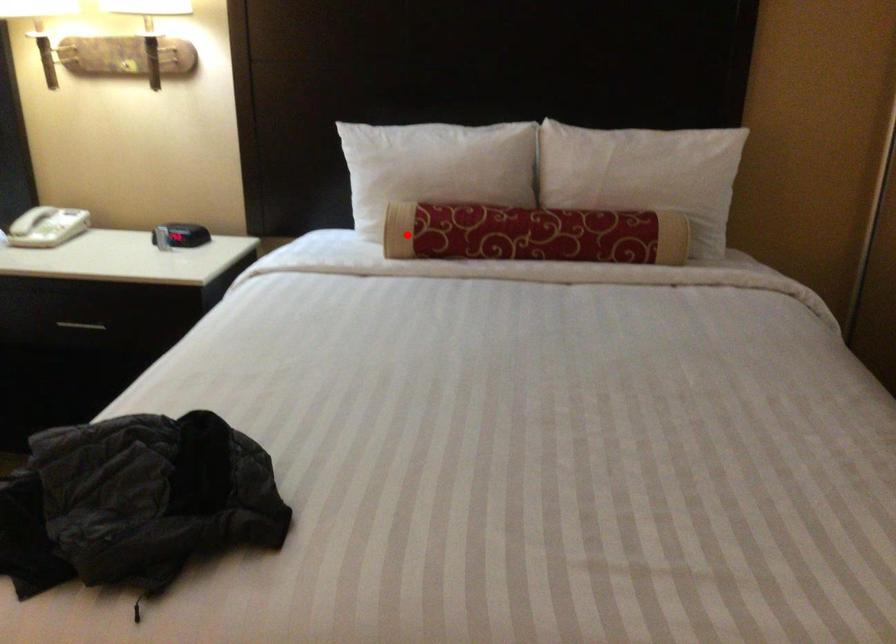
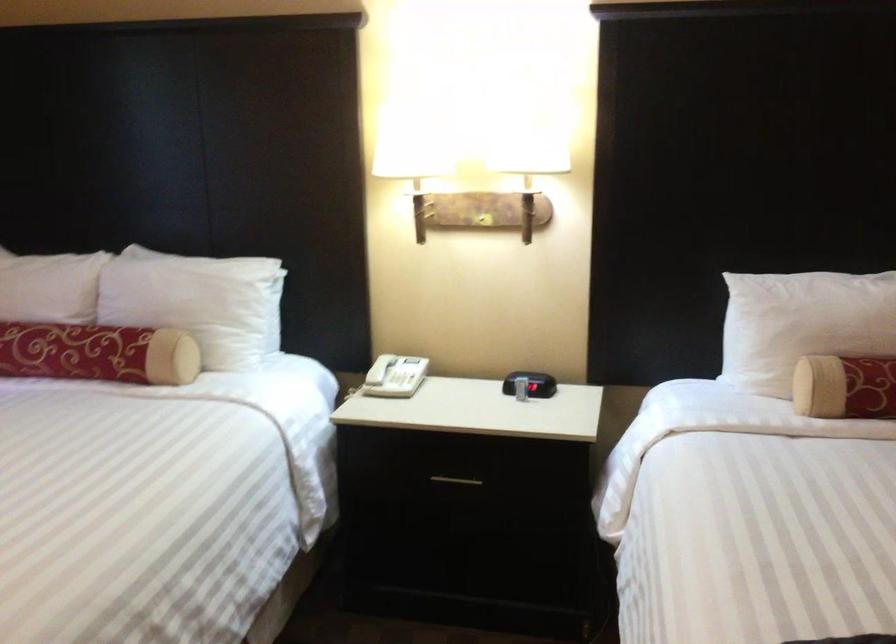
Question: I am providing you with two images of the same scene from different viewpoints. In image1, a red point is highlighted. Considering the same 3D point in image2, which of the following is correct?

Choices:
 (A) It is closer
 (B) It is farther

Answer: (A)